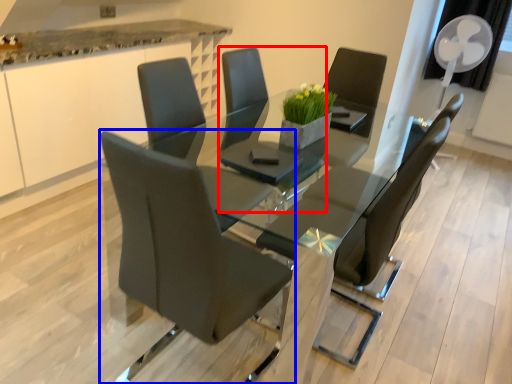
Question: Which object appears farthest to the camera in this image, chair (highlighted by a red box) or chair (highlighted by a blue box)?

Choices:
 (A) chair
 (B) chair

Answer: (A)